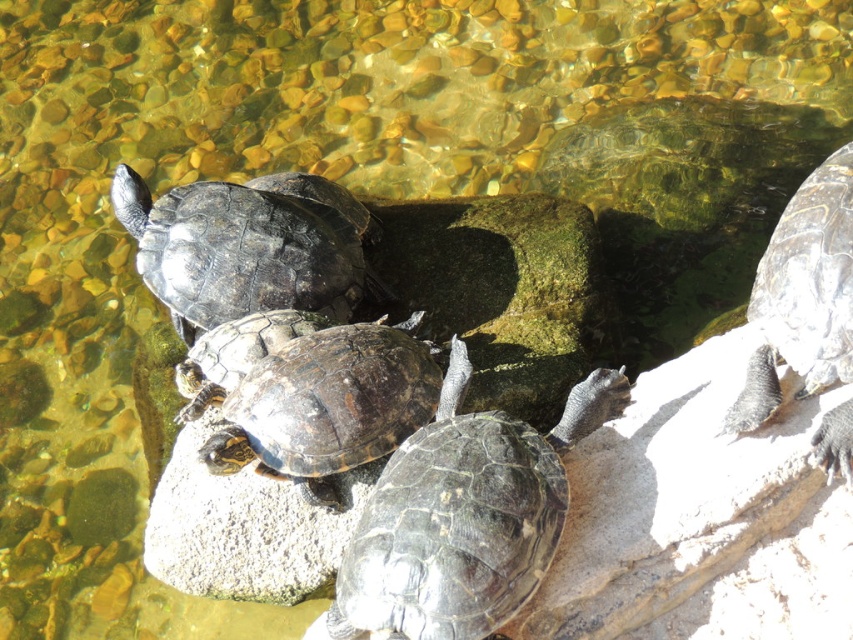
You are a photographer trying to capture both the shiny dark gray tortoise at center and the shiny brown tortoise at center in a single frame. Based on their positions, which tortoise should you adjust your camera angle to focus on first to ensure both are in the shot?

The shiny dark gray tortoise at center is positioned on the left side of the shiny brown tortoise at center. To capture both in a single frame, you should first focus on the shiny dark gray tortoise at center to ensure the left side of the frame includes it, then adjust to include the shiny brown tortoise at center on the right.

You are standing at the edge of the water and want to reach the shiny dark green tortoise at center without getting your feet wet. Which direction should you move to approach it?

Since the shiny dark green tortoise at center is located at point (463, 516) in the image, you should move towards the center of the image to reach it while staying on the dry part of the rock.

From the picture: You are a wildlife photographer aiming to capture a closeup of the shiny dark green tortoise at center and the shiny brown tortoise at center. Based on their sizes, which tortoise will appear bigger in your photo?

The shiny dark green tortoise at center will appear bigger in the photo since it has a larger size compared to the shiny brown tortoise at center.